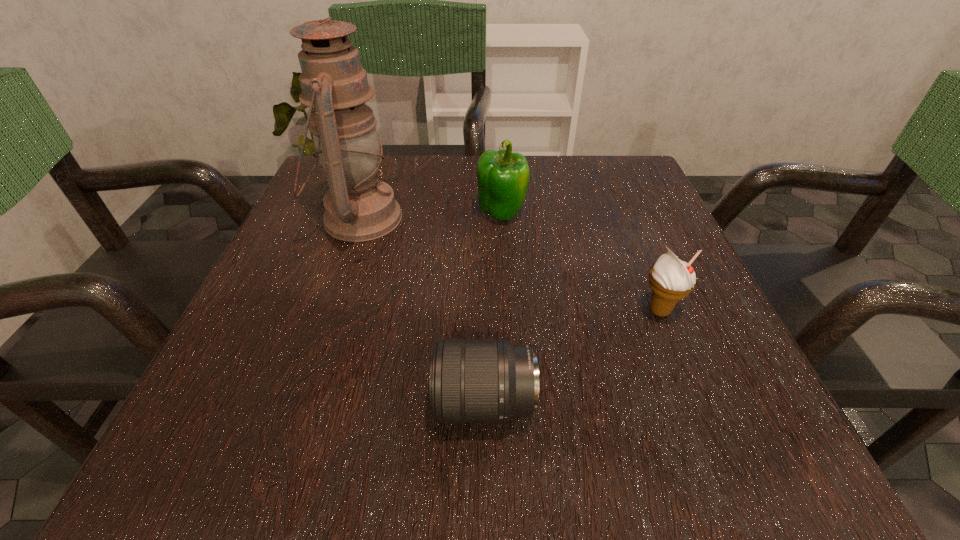
Find the location of a particular element. the tallest object is located at coordinates (358, 207).

Locate an element on the screen. The image size is (960, 540). the leftmost object is located at coordinates (358, 207).

You are a GUI agent. You are given a task and a screenshot of the screen. Output one action in this format:
    pyautogui.click(x=<x>, y=<y>)
    Task: Click on the bell pepper
    
    Given the screenshot: What is the action you would take?
    pyautogui.click(x=503, y=176)

This screenshot has width=960, height=540. Identify the location of icecream. (670, 279).

The height and width of the screenshot is (540, 960). What are the coordinates of `the third tallest object` in the screenshot? It's located at (670, 279).

Identify the location of the nearest object. (471, 380).

Where is `the shortest object`? The height and width of the screenshot is (540, 960). the shortest object is located at coordinates (471, 380).

The height and width of the screenshot is (540, 960). I want to click on vacant space located 0.120m on the back of the leftmost object, so click(x=378, y=161).

In order to click on blank area located 0.250m on the left of the bell pepper in this screenshot , I will do `click(354, 213)`.

Locate an element on the screen. This screenshot has width=960, height=540. free region located on the left of the rightmost object is located at coordinates (469, 310).